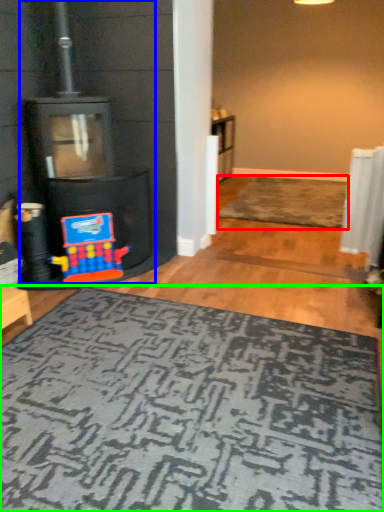
Question: Which object is positioned closest to doormat (highlighted by a red box)? Select from fireplace (highlighted by a blue box) and mat (highlighted by a green box).

Choices:
 (A) fireplace
 (B) mat

Answer: (A)